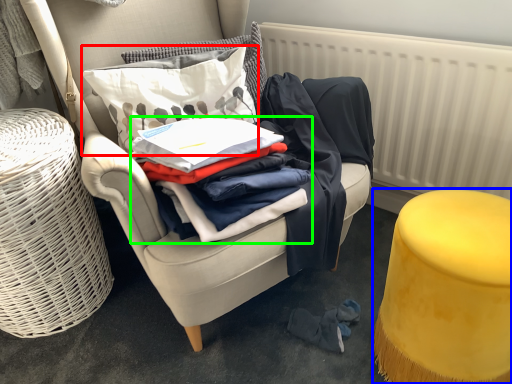
Question: Based on their relative distances, which object is nearer to pillow (highlighted by a red box)? Choose from stool (highlighted by a blue box) and clothing (highlighted by a green box).

Choices:
 (A) stool
 (B) clothing

Answer: (B)